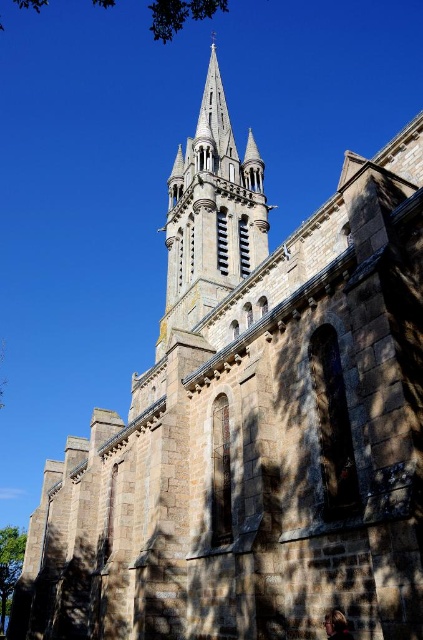
Which of these two, smooth stone tower at center or green leafy tree at lower left, stands taller?

Standing taller between the two is smooth stone tower at center.

Who is positioned more to the left, smooth stone tower at center or green leafy tree at lower left?

green leafy tree at lower left is more to the left.

Where is `smooth stone tower at center`? The image size is (423, 640). smooth stone tower at center is located at coordinates (211, 214).

Where is `smooth stone tower at center`? Image resolution: width=423 pixels, height=640 pixels. smooth stone tower at center is located at coordinates pos(211,214).

Between green leafy tree at upper center and green leafy tree at lower left, which one is positioned lower?

Positioned lower is green leafy tree at lower left.

In order to click on green leafy tree at upper center in this screenshot , I will do (x=180, y=13).

Based on the photo, between smooth stone tower at center and green leafy tree at upper center, which one has less height?

With less height is smooth stone tower at center.

Does smooth stone tower at center have a larger size compared to green leafy tree at upper center?

No, smooth stone tower at center is not bigger than green leafy tree at upper center.

Is point (211, 124) farther from camera compared to point (164, 8)?

Yes, it is behind point (164, 8).

Identify the location of smooth stone tower at center. This screenshot has height=640, width=423. (211, 214).